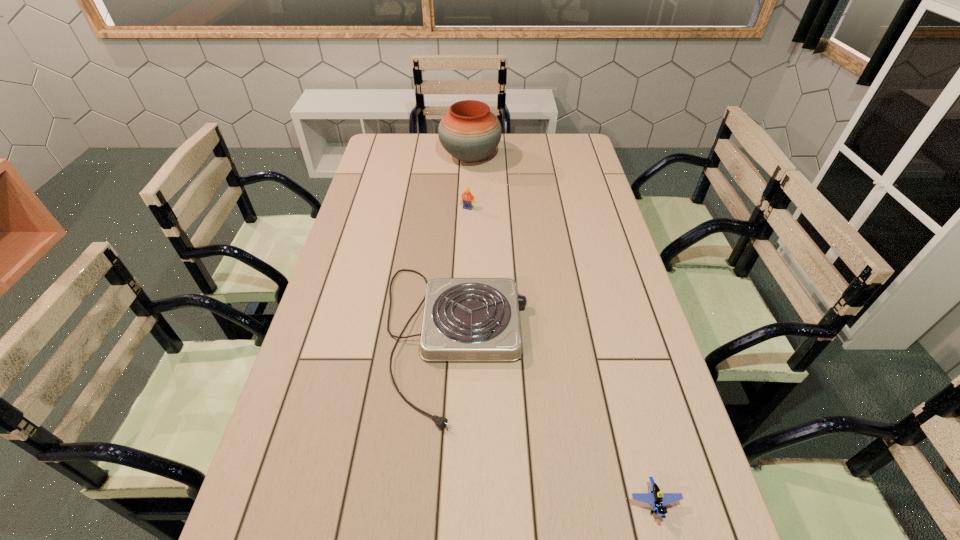
Find the location of `object present at the far edge`. object present at the far edge is located at coordinates (469, 132).

The height and width of the screenshot is (540, 960). In order to click on object present at the right edge in this screenshot , I will do `click(655, 497)`.

The width and height of the screenshot is (960, 540). Find the location of `free region at the far edge of the desktop`. free region at the far edge of the desktop is located at coordinates (525, 139).

This screenshot has height=540, width=960. I want to click on free space at the left edge of the desktop, so click(338, 325).

Where is `vacant position at the right edge of the desktop`? The width and height of the screenshot is (960, 540). vacant position at the right edge of the desktop is located at coordinates (574, 166).

You are a GUI agent. You are given a task and a screenshot of the screen. Output one action in this format:
    pyautogui.click(x=<x>, y=<y>)
    Task: Click on the free space at the far left corner
    Image resolution: width=960 pixels, height=540 pixels.
    Given the screenshot: What is the action you would take?
    pyautogui.click(x=373, y=154)

This screenshot has height=540, width=960. I want to click on unoccupied area between the tallest object and the rightmost object, so click(x=563, y=330).

Find the location of `free spot between the third shortest object and the hotplate`. free spot between the third shortest object and the hotplate is located at coordinates (461, 273).

Where is `vacant space in between the hotplate and the second tallest object`? Image resolution: width=960 pixels, height=540 pixels. vacant space in between the hotplate and the second tallest object is located at coordinates (461, 273).

You are a GUI agent. You are given a task and a screenshot of the screen. Output one action in this format:
    pyautogui.click(x=<x>, y=<y>)
    Task: Click on the free spot between the hotplate and the third nearest object
    
    Given the screenshot: What is the action you would take?
    pyautogui.click(x=461, y=273)